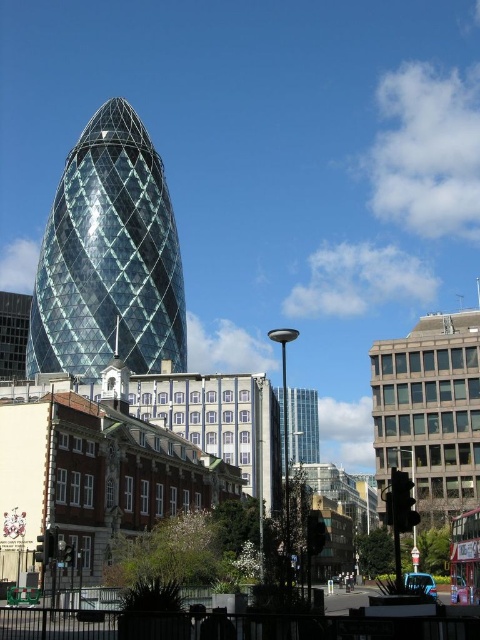
You are a city planner analyzing the urban layout. Given the scene described, which object would you estimate has a greater width when viewed from the front? The transparent glass tower at center or the glassy metallic skyscraper at center?

The transparent glass tower at center might be wider than glassy metallic skyscraper at center according to the description.

You are standing in the urban scene facing the Gherkin building. A point is marked at coordinates (x=118, y=125). If you want to place a 1.7 meter tall statue so that it is exactly at that point, will the statue be visible from your current position?

The point at coordinates (x=118, y=125) is 124.70 meters away from the viewer. Since the statue is only 1.7 meters tall, it would likely be visible from that distance as long as there are no obstructions like buildings or trees blocking the line of sight. However, the description does not mention any obstructions, so based on the given information, the statue would be visible.